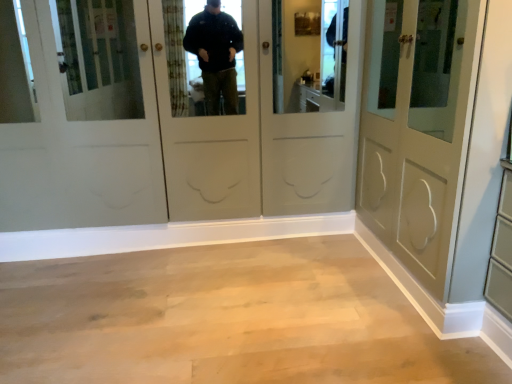
Question: Is light wood floor at center taller than matte gray door at right?

Choices:
 (A) yes
 (B) no

Answer: (B)

Question: Can you confirm if light wood floor at center is smaller than matte gray door at right?

Choices:
 (A) yes
 (B) no

Answer: (A)

Question: From the image's perspective, is light wood floor at center over matte gray door at right?

Choices:
 (A) yes
 (B) no

Answer: (B)

Question: Is light wood floor at center further to the viewer compared to matte gray door at right?

Choices:
 (A) no
 (B) yes

Answer: (B)

Question: Is light wood floor at center located outside matte gray door at right?

Choices:
 (A) no
 (B) yes

Answer: (B)

Question: Does light wood floor at center appear on the right side of matte gray door at right?

Choices:
 (A) no
 (B) yes

Answer: (A)

Question: Is matte gray door at right oriented away from light wood floor at center?

Choices:
 (A) no
 (B) yes

Answer: (A)

Question: Does matte gray door at right have a lesser width compared to light wood floor at center?

Choices:
 (A) no
 (B) yes

Answer: (B)

Question: From the image's perspective, does matte gray door at right appear lower than light wood floor at center?

Choices:
 (A) no
 (B) yes

Answer: (A)

Question: Can you confirm if matte gray door at right is shorter than light wood floor at center?

Choices:
 (A) no
 (B) yes

Answer: (A)

Question: Is matte gray door at right located outside light wood floor at center?

Choices:
 (A) yes
 (B) no

Answer: (A)

Question: Does matte gray door at right appear on the right side of light wood floor at center?

Choices:
 (A) no
 (B) yes

Answer: (B)

Question: From the image's perspective, is matte gray door at right above or below light wood floor at center?

Choices:
 (A) below
 (B) above

Answer: (B)